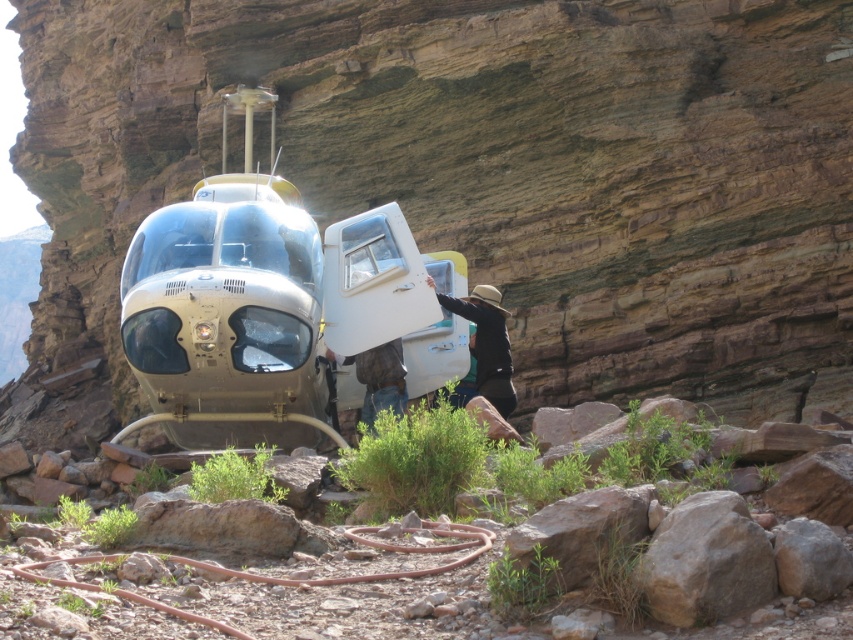
You are a photographer planning to take a picture of the matte white helicopter at center and the gray rough rock at center. Based on their positions, which object should you focus on first if you want to capture both in a single frame without moving the camera?

The matte white helicopter at center is to the left of the gray rough rock at center, so you should focus on the matte white helicopter at center first to ensure both are in frame.

You are a hiker who has just arrived at the scene. You see a point marked at coordinates [274,312]. What object is located at that point?

The point at coordinates [274,312] indicates the metallic silver helicopter at center.